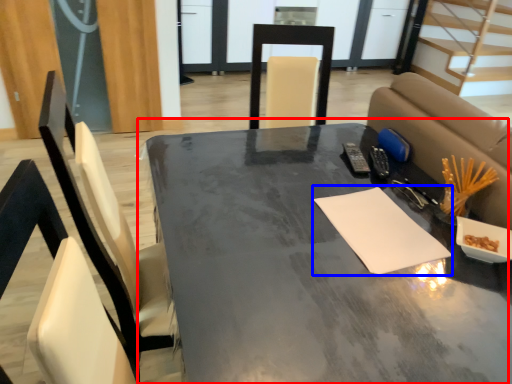
Question: Which of the following is the closest to the observer, table (highlighted by a red box) or notepad (highlighted by a blue box)?

Choices:
 (A) table
 (B) notepad

Answer: (A)